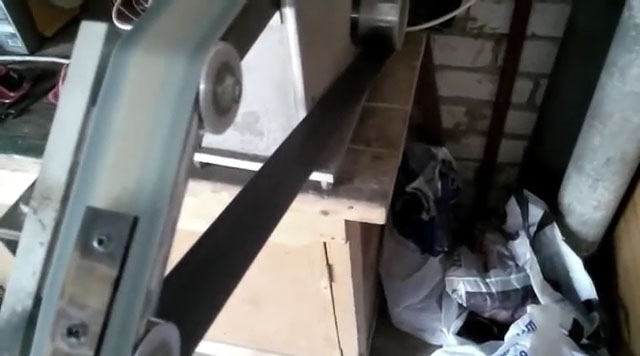
Image resolution: width=640 pixels, height=356 pixels. Find the location of `cabinet`. cabinet is located at coordinates (264, 299).